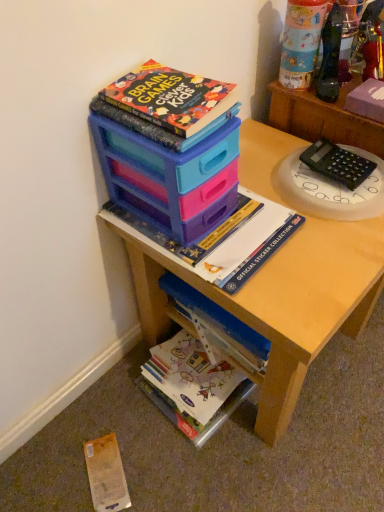
Find the location of `vacant space to the left of white glossy book at lower center, the 3th book in the top-to-bottom sequence`. vacant space to the left of white glossy book at lower center, the 3th book in the top-to-bottom sequence is located at coordinates (107, 409).